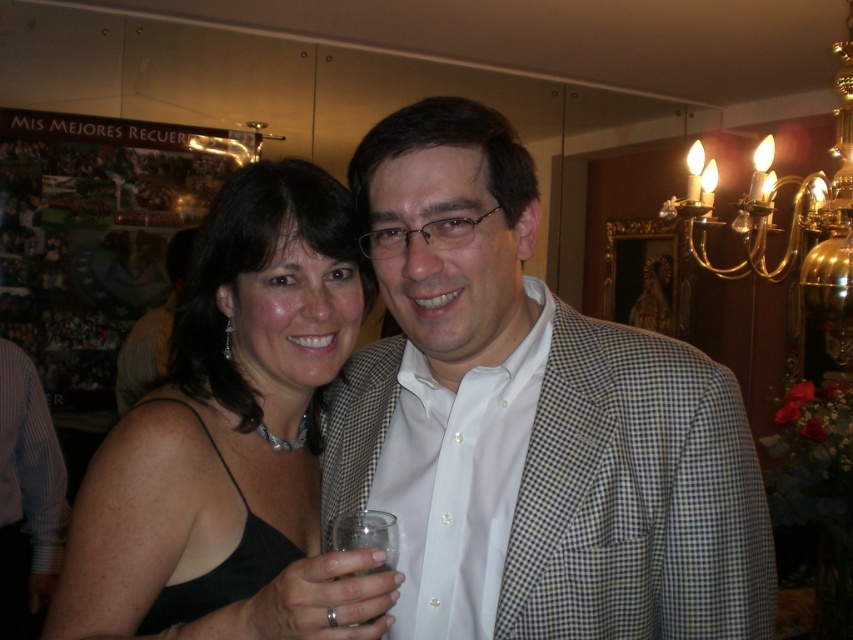
Is point (518, 339) in front of point (4, 392)?

Yes.

Is white checkered blazer at center closer to the viewer compared to blue striped shirt at left?

Yes, it is in front of blue striped shirt at left.

Does point (335, 429) come farther from viewer compared to point (57, 477)?

No, it is not.

The height and width of the screenshot is (640, 853). I want to click on white checkered blazer at center, so click(552, 406).

Does black satin dress at center have a lesser height compared to matte black suit at center?

Yes, black satin dress at center is shorter than matte black suit at center.

Where is `black satin dress at center`? black satin dress at center is located at coordinates (231, 438).

Locate an element on the screen. black satin dress at center is located at coordinates (231, 438).

Between matte black suit at center and clear glass at lower center, which one appears on the right side from the viewer's perspective?

clear glass at lower center is more to the right.

Which is behind, point (169, 316) or point (347, 538)?

Point (169, 316)

You are a GUI agent. You are given a task and a screenshot of the screen. Output one action in this format:
    pyautogui.click(x=<x>, y=<y>)
    Task: Click on the matte black suit at center
    This screenshot has width=853, height=640.
    Given the screenshot: What is the action you would take?
    pos(152,330)